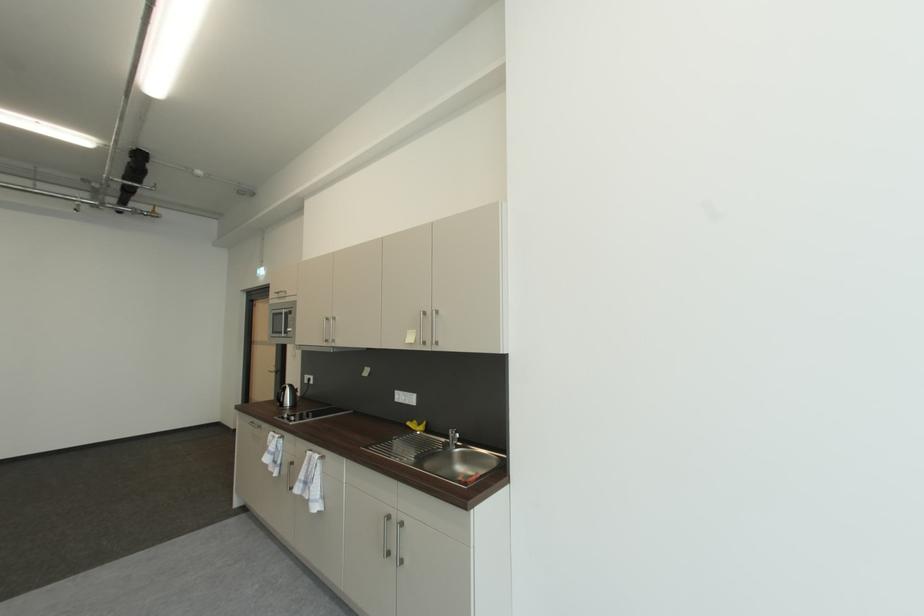
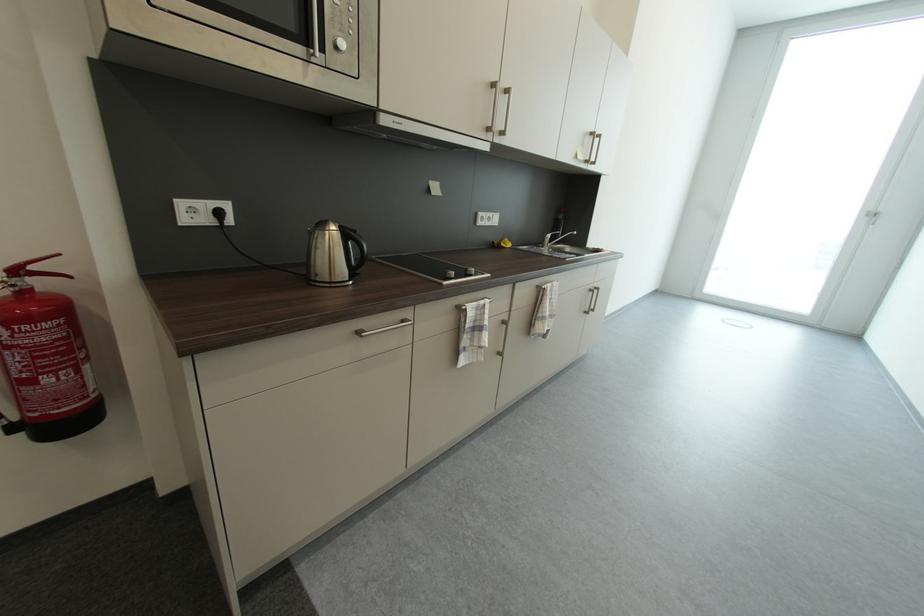
Find the pixel in the second image that matches pixel 395 517 in the first image.

(598, 292)